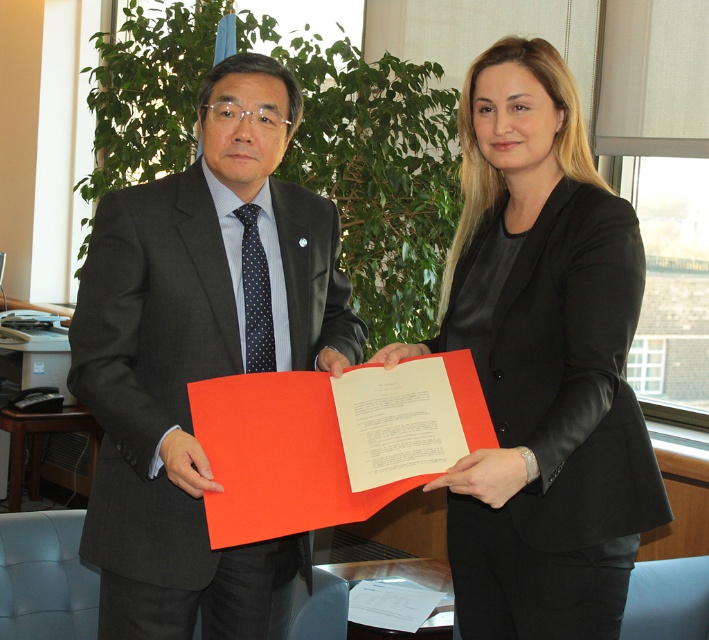
Question: Does black leather jacket at center lie behind matte black suit at center?

Choices:
 (A) yes
 (B) no

Answer: (B)

Question: Which of the following is the closest to the observer?

Choices:
 (A) matte black suit at center
 (B) black leather jacket at center

Answer: (B)

Question: Can you confirm if black leather jacket at center is smaller than matte black suit at center?

Choices:
 (A) no
 (B) yes

Answer: (A)

Question: Which point is closer to the camera?

Choices:
 (A) (530, 442)
 (B) (223, 237)

Answer: (A)

Question: Is black leather jacket at center to the left of matte black suit at center from the viewer's perspective?

Choices:
 (A) yes
 (B) no

Answer: (B)